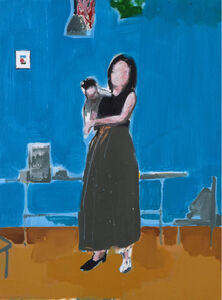
Find the location of a particular element. gray simple chair outline is located at coordinates (203, 222), (6, 248).